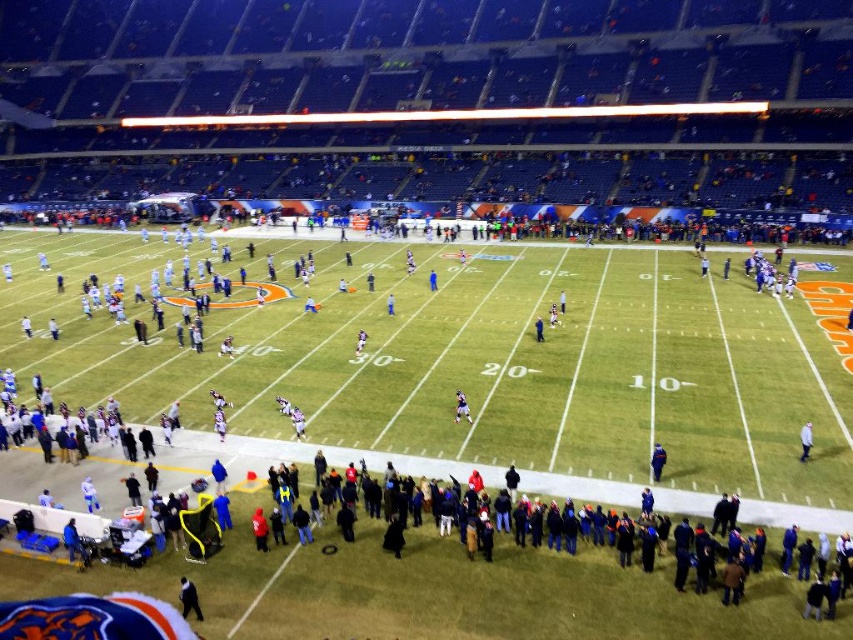
Question: Based on their relative distances, which object is nearer to the black matte jacket at lower center?

Choices:
 (A) white matte jacket at lower right
 (B) blue fabric jacket at center

Answer: (A)

Question: Is black matte jacket at lower center smaller than blue fabric jacket at center?

Choices:
 (A) yes
 (B) no

Answer: (B)

Question: Is white matte jacket at lower right further to camera compared to blue fabric jacket at center?

Choices:
 (A) no
 (B) yes

Answer: (A)

Question: Which object appears farthest from the camera in this image?

Choices:
 (A) white matte jacket at lower right
 (B) blue fabric jacket at center
 (C) black matte jacket at lower center
 (D) dark blue jersey at center

Answer: (B)

Question: Which of the following is the closest to the observer?

Choices:
 (A) (459, 416)
 (B) (537, 337)

Answer: (A)

Question: From the image, what is the correct spatial relationship of black matte jacket at lower center in relation to white matte jacket at lower right?

Choices:
 (A) right
 (B) left

Answer: (B)